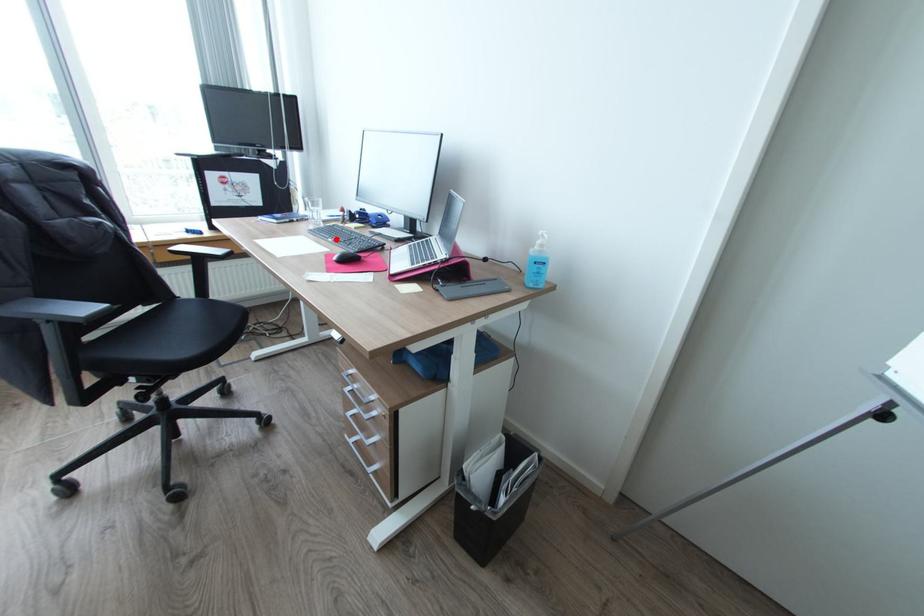
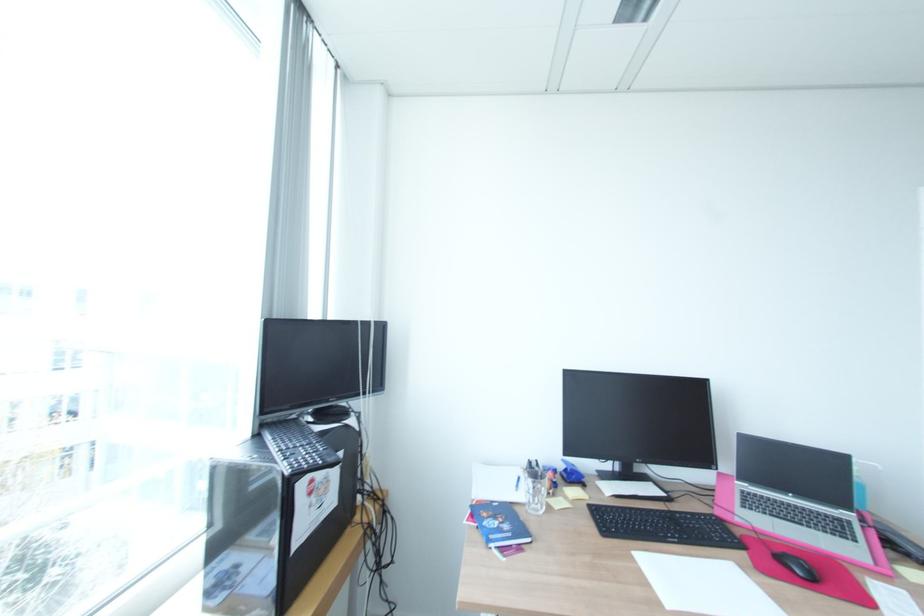
Locate, in the second image, the point that corresponds to the highlighted location in the first image.

(681, 541)